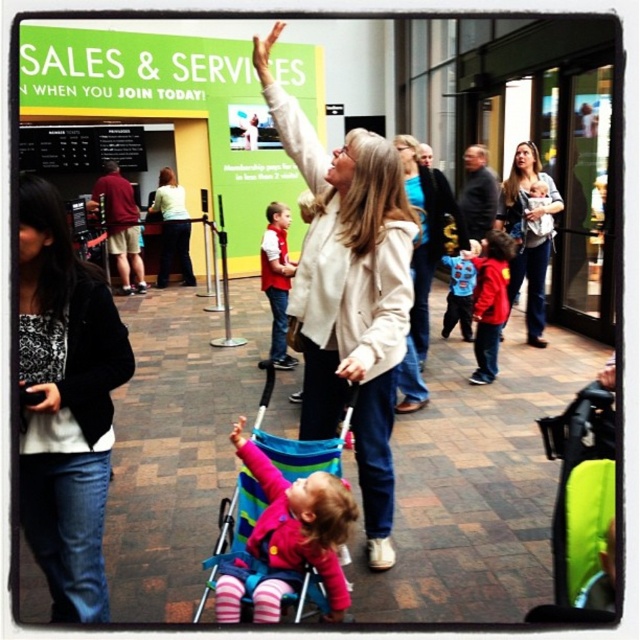
Question: Estimate the real-world distances between objects in this image. Which object is farther from the matte red vest at center?

Choices:
 (A) black textured jacket at left
 (B) red fleece jacket at center
 (C) multicolored fabric stroller at center

Answer: (A)

Question: Does black textured jacket at left appear on the left side of neon green fabric folding chair at center?

Choices:
 (A) no
 (B) yes

Answer: (B)

Question: Does white fleece jacket at center appear on the left side of matte red vest at center?

Choices:
 (A) yes
 (B) no

Answer: (B)

Question: Which object appears farthest from the camera in this image?

Choices:
 (A) white fleece jacket at center
 (B) matte white jacket at center

Answer: (B)

Question: Which point appears farthest from the camera in this image?

Choices:
 (A) (573, 593)
 (B) (548, 177)
 (C) (202, 564)
 (D) (269, 266)

Answer: (B)

Question: Does neon green fabric folding chair at center appear over matte white jacket at center?

Choices:
 (A) yes
 (B) no

Answer: (B)